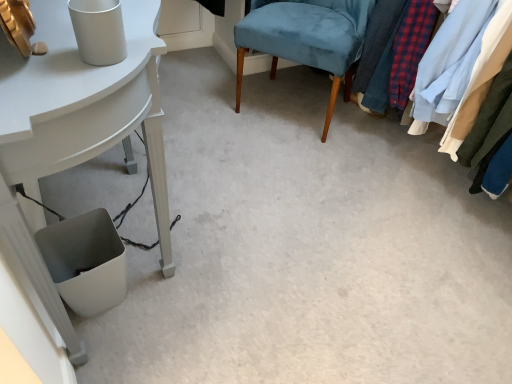
The width and height of the screenshot is (512, 384). I want to click on textured fabric clothes at right, so click(x=481, y=74).

In order to click on velvet blue chair at center in this screenshot , I will do `click(307, 39)`.

Where is `white glossy table at lower left`? Image resolution: width=512 pixels, height=384 pixels. white glossy table at lower left is located at coordinates point(83,104).

Locate an element on the screen. This screenshot has height=384, width=512. textured fabric clothes at right is located at coordinates (481, 74).

Consider the image. How many degrees apart are the facing directions of textured fabric clothes at right and white glossy table at lower left?

textured fabric clothes at right and white glossy table at lower left are facing 176 degrees away from each other.

Is textured fabric clothes at right oriented away from white glossy table at lower left?

That's not correct — textured fabric clothes at right is not looking away from white glossy table at lower left.

Where is `table on the left of textured fabric clothes at right`? The width and height of the screenshot is (512, 384). table on the left of textured fabric clothes at right is located at coordinates (83, 104).

From the image's perspective, would you say textured fabric clothes at right is shown under white glossy table at lower left?

No, from the image's perspective, textured fabric clothes at right is not beneath white glossy table at lower left.

Can you confirm if velvet blue chair at center is wider than textured fabric clothes at right?

No, velvet blue chair at center is not wider than textured fabric clothes at right.

Does point (267, 45) appear closer or farther from the camera than point (493, 56)?

Clearly, point (267, 45) is more distant from the camera than point (493, 56).

Based on the photo, does velvet blue chair at center come behind textured fabric clothes at right?

Yes, velvet blue chair at center is further from the camera.

In terms of size, does velvet blue chair at center appear bigger or smaller than textured fabric clothes at right?

Considering their sizes, velvet blue chair at center takes up less space than textured fabric clothes at right.

From the image's perspective, which object appears higher, white glossy table at lower left or textured fabric clothes at right?

textured fabric clothes at right.

Does white glossy table at lower left turn towards textured fabric clothes at right?

Yes, white glossy table at lower left is facing textured fabric clothes at right.

Is white glossy table at lower left taller or shorter than textured fabric clothes at right?

Considering their sizes, white glossy table at lower left has more height than textured fabric clothes at right.

In terms of height, does white glossy table at lower left look taller or shorter compared to velvet blue chair at center?

Considering their sizes, white glossy table at lower left has more height than velvet blue chair at center.

Is white glossy table at lower left far away from velvet blue chair at center?

white glossy table at lower left is near velvet blue chair at center, not far away.

Considering the sizes of objects white glossy table at lower left and velvet blue chair at center in the image provided, who is bigger, white glossy table at lower left or velvet blue chair at center?

white glossy table at lower left is bigger.

From a real-world perspective, is white glossy table at lower left over velvet blue chair at center?

Yes, from a real-world perspective, white glossy table at lower left is on top of velvet blue chair at center.

Which of these two, velvet blue chair at center or white glossy table at lower left, stands shorter?

With less height is velvet blue chair at center.

Is velvet blue chair at center positioned with its back to white glossy table at lower left?

No, white glossy table at lower left is not at the back of velvet blue chair at center.

Between velvet blue chair at center and white glossy table at lower left, which one appears on the left side from the viewer's perspective?

Positioned to the left is white glossy table at lower left.

Considering the sizes of objects textured fabric clothes at right and velvet blue chair at center in the image provided, who is taller, textured fabric clothes at right or velvet blue chair at center?

With more height is textured fabric clothes at right.

This screenshot has height=384, width=512. What are the coordinates of `closet located above the velvet blue chair at center (from a real-world perspective)` in the screenshot? It's located at (481, 74).

Is textured fabric clothes at right positioned behind velvet blue chair at center?

Result: No.

This screenshot has height=384, width=512. Identify the location of table lying in front of the textured fabric clothes at right. (83, 104).

This screenshot has width=512, height=384. There is a velvet blue chair at center. What are the coordinates of `closet above it (from a real-world perspective)` in the screenshot? It's located at (481, 74).

From the picture: Estimate the real-world distances between objects in this image. Which object is further from textured fabric clothes at right, white glossy table at lower left or velvet blue chair at center?

Among the two, white glossy table at lower left is located further to textured fabric clothes at right.

From the image, which object appears to be farther from textured fabric clothes at right, velvet blue chair at center or white glossy table at lower left?

white glossy table at lower left.

Looking at the image, which one is located further to velvet blue chair at center, white glossy table at lower left or textured fabric clothes at right?

white glossy table at lower left is further to velvet blue chair at center.

Based on their spatial positions, is velvet blue chair at center or textured fabric clothes at right closer to white glossy table at lower left?

velvet blue chair at center is closer to white glossy table at lower left.

Looking at the image, which one is located further to velvet blue chair at center, textured fabric clothes at right or white glossy table at lower left?

Among the two, white glossy table at lower left is located further to velvet blue chair at center.

When comparing their distances from white glossy table at lower left, does textured fabric clothes at right or velvet blue chair at center seem further?

Among the two, textured fabric clothes at right is located further to white glossy table at lower left.

Where is `chair between white glossy table at lower left and textured fabric clothes at right from left to right`? chair between white glossy table at lower left and textured fabric clothes at right from left to right is located at coordinates (307, 39).